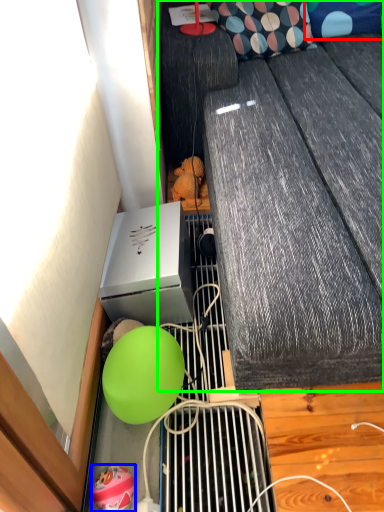
Question: Based on their relative distances, which object is nearer to pillow (highlighted by a red box)? Choose from balloon (highlighted by a blue box) and furniture (highlighted by a green box).

Choices:
 (A) balloon
 (B) furniture

Answer: (B)